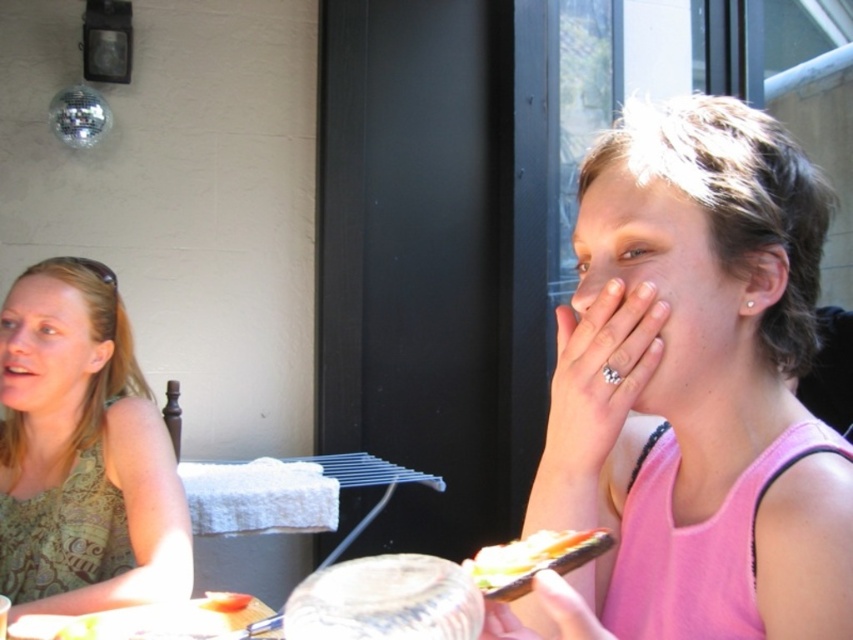
You are a photographer taking a picture of the green patterned tank top at left and the smooth white bread at lower center. Which object will appear larger in the photo?

The green patterned tank top at left will appear larger in the photo because it is positioned closer to the camera than the smooth white bread at lower center.

You are a food delivery person who needs to place a hot meal on the table without touching the green patterned tank top at left. The minimum safe distance required is 1 meter. Can you place the meal directly next to the shiny plastic sandwich at lower center?

The green patterned tank top at left is 1.01 meters from the shiny plastic sandwich at lower center. Since the required minimum safe distance is 1 meter, placing the meal next to the shiny plastic sandwich at lower center would maintain the necessary distance from the green patterned tank top at left.